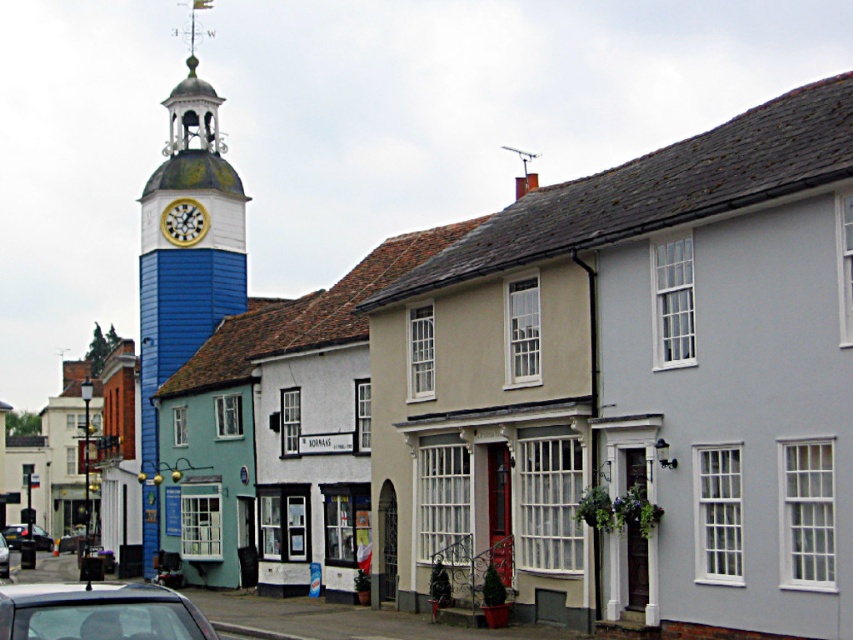
You are an architect analyzing the street scene. You need to determine which structure is taller between the blue painted wood clock tower at left and the gold metallic clock at upper center. Based on the scene, which one is taller?

The blue painted wood clock tower at left is taller than the gold metallic clock at upper center.

From the picture: You are standing in the middle of the street looking at the charming buildings. Where is the gold metallic clock at upper center located in terms of its 2D coordinates?

The gold metallic clock at upper center is located at the 2D coordinates of point (183, 221).